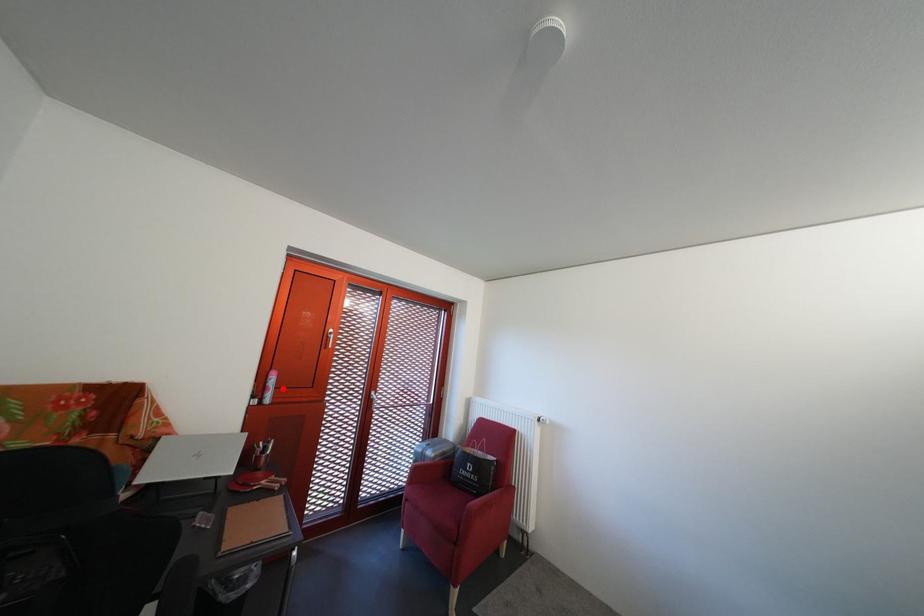
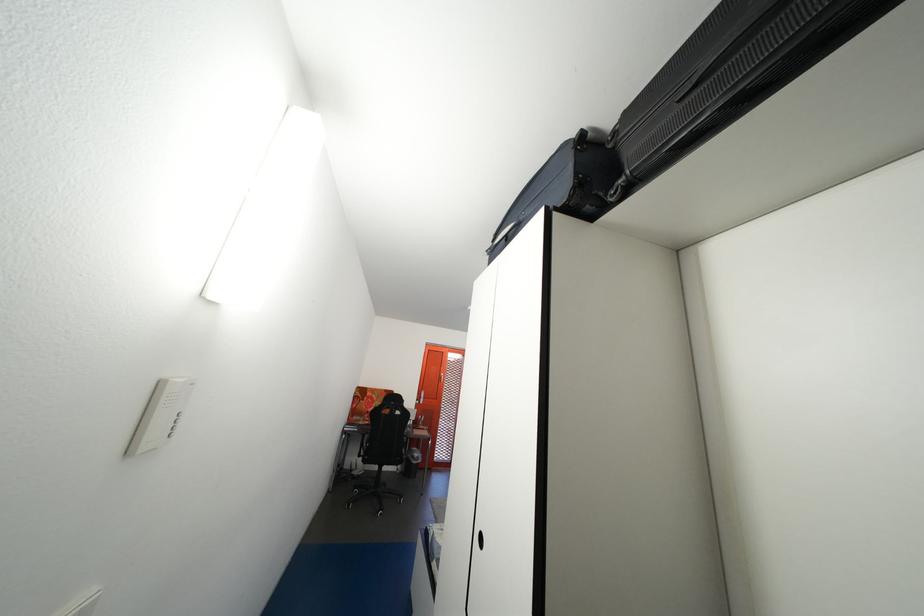
Question: I am providing you with two images of the same scene from different viewpoints. Image1 has a red point marked. In image2, the corresponding 3D location appears at what relative position? Reply with the corresponding letter.

Choices:
 (A) Closer
 (B) Farther

Answer: (B)